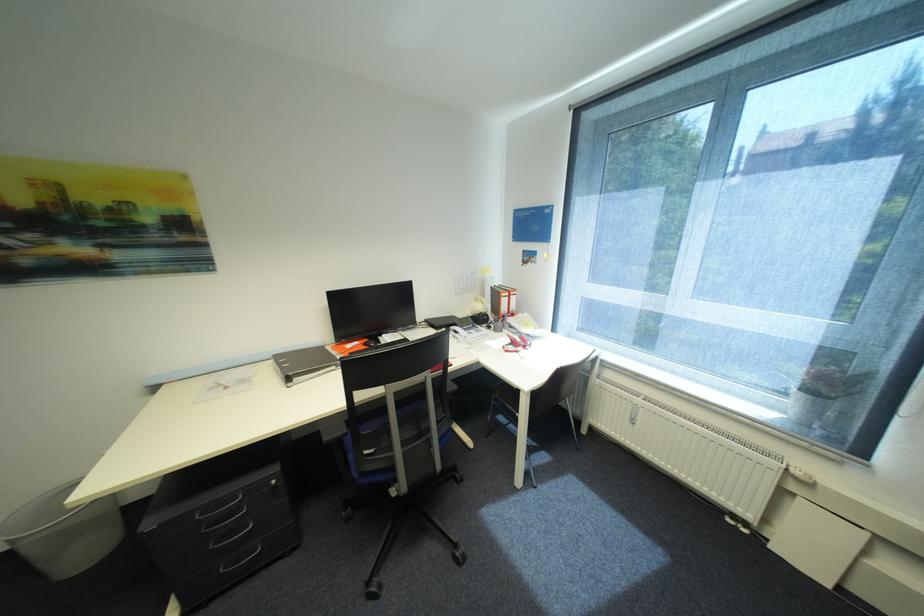
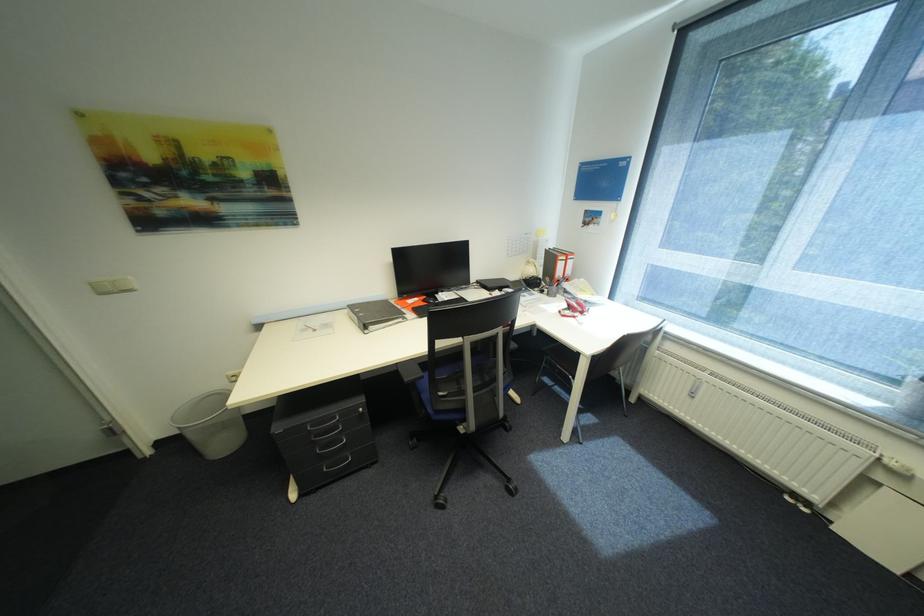
Question: What movement of the cameraman would produce the second image?

Choices:
 (A) Left
 (B) Right
 (C) Forward
 (D) Backward

Answer: (A)